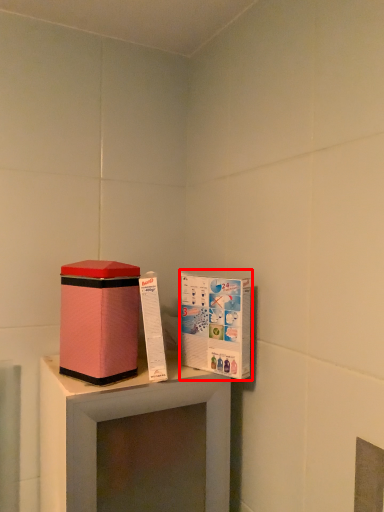
Question: From the image, what is the correct spatial relationship of cardboard box (annotated by the red box) in relation to box?

Choices:
 (A) left
 (B) right

Answer: (B)